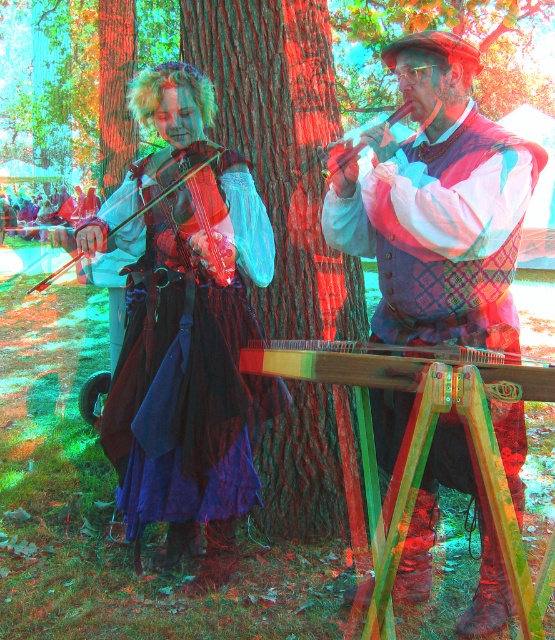
You are planning to place a rectangular stage backdrop that is 1.5 meters wide behind the brown rough tree trunk at center and the wooden harp at center. Considering their widths, which object will have more space between its sides and the backdrop edges?

The wooden harp at center will have more space between its sides and the backdrop edges because the brown rough tree trunk at center is wider than the wooden harp at center, so the harp takes up less width, leaving more space on either side.

You are a performer who wants to set up a stage for a small audience. The stage has limited vertical space. Given the brown rough tree trunk at center and the wooden harp at center, which object would you choose to place closer to the audience to ensure it doesn

The wooden harp at center is shorter than the brown rough tree trunk at center, so placing the wooden harp at center closer to the audience would ensure it fits within the stage

You are a photographer standing in front of the scene. You want to take a photo focusing on the velvet purple dress at center and the brown rough tree trunk at center. Which object will appear larger in the photo?

The velvet purple dress at center will appear larger in the photo because it is closer to the viewer than the brown rough tree trunk at center.